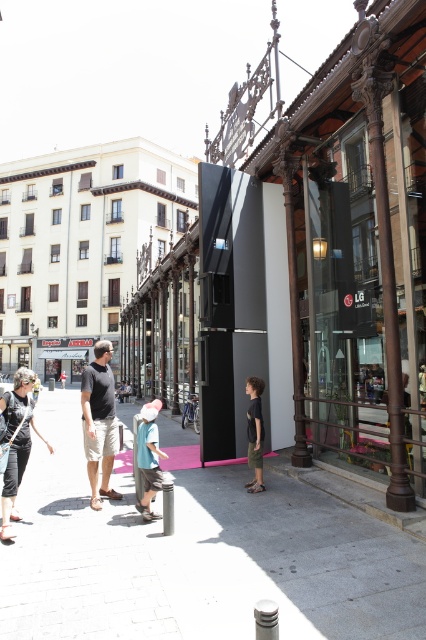
This screenshot has height=640, width=426. Describe the element at coordinates (198, 556) in the screenshot. I see `pink rubber mat at center` at that location.

Does pink rubber mat at center appear on the left side of pink fabric hat at center?

Yes, pink rubber mat at center is to the left of pink fabric hat at center.

Where is `pink rubber mat at center`? pink rubber mat at center is located at coordinates (198, 556).

This screenshot has width=426, height=640. Identify the location of pink rubber mat at center. (198, 556).

Measure the distance between pink rubber mat at center and dark green shorts at center.

1.44 meters

Is pink rubber mat at center smaller than dark green shorts at center?

No, pink rubber mat at center is not smaller than dark green shorts at center.

Where is `pink rubber mat at center`? The image size is (426, 640). pink rubber mat at center is located at coordinates (198, 556).

Image resolution: width=426 pixels, height=640 pixels. Identify the location of pink rubber mat at center. (198, 556).

Can you confirm if light brown shorts at center is bigger than pink fabric hat at center?

Yes.

Between light brown shorts at center and pink fabric hat at center, which one has more height?

light brown shorts at center is taller.

Between point (106, 417) and point (140, 428), which one is positioned behind?

The point (106, 417) is more distant.

Locate an element on the screen. The height and width of the screenshot is (640, 426). light brown shorts at center is located at coordinates (100, 422).